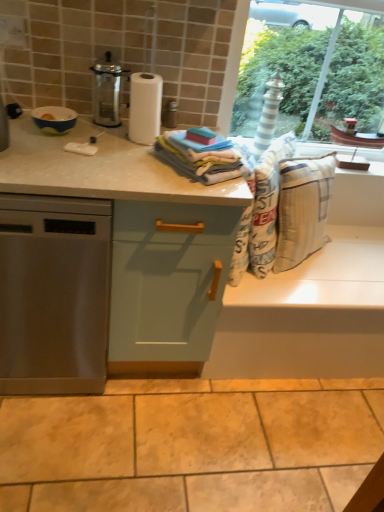
Image resolution: width=384 pixels, height=512 pixels. In order to click on blank space to the left of soft cotton towels at center in this screenshot , I will do `click(133, 159)`.